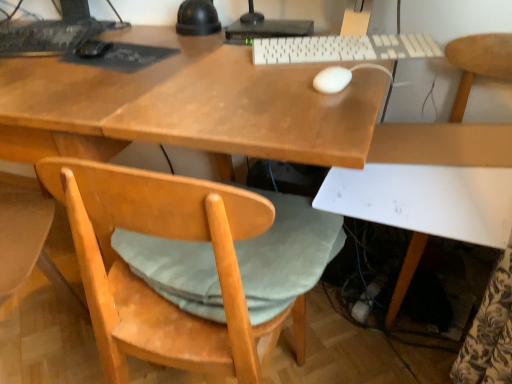
Image resolution: width=512 pixels, height=384 pixels. Identify the location of free location in front of white plastic desktop computer at upper center. pos(241,53).